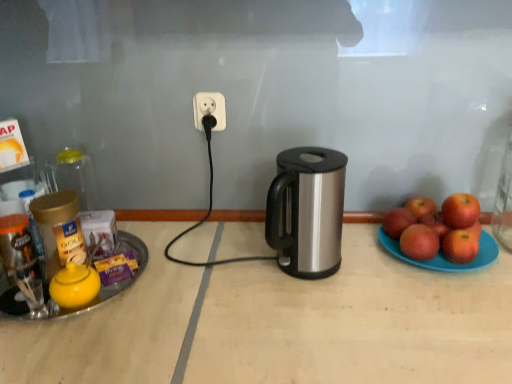
You are a GUI agent. You are given a task and a screenshot of the screen. Output one action in this format:
    pyautogui.click(x=<x>, y=<y>)
    Task: Click on the free space to the left of silver metallic kettle at center
    This screenshot has width=512, height=384.
    Given the screenshot: What is the action you would take?
    pyautogui.click(x=238, y=269)